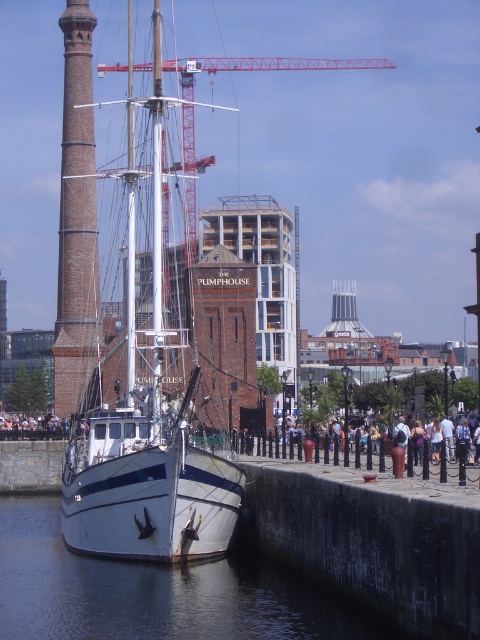
You are a photographer planning to capture the waterfront scene. You have two brick towers in view, the brick tower at left and the brick tower at center. Which tower should you focus on to ensure it appears larger in your photo?

The brick tower at left is much taller than the brick tower at center, so focusing on the brick tower at left will make it appear larger in the photo.

In the scene shown: You are a photographer planning to take a photo of the white matte sailboat at center and the brick tower at left. Based on their positions, which object would appear closer to the top of the photo frame?

The white matte sailboat at center appears closer to the top of the photo frame because it is positioned above the brick tower at left.

You are a marine biologist who needs to collect water samples from the clear water at boat front. Your boat, the white matte sailboat at center, has a water collection device with a maximum reach of 15 meters. Can you collect the sample without leaving the boat?

The white matte sailboat at center is 14.94 meters away from the clear water at boat front. Since the device can reach up to 15 meters, it is just within range. Therefore, you can collect the sample without leaving the boat.